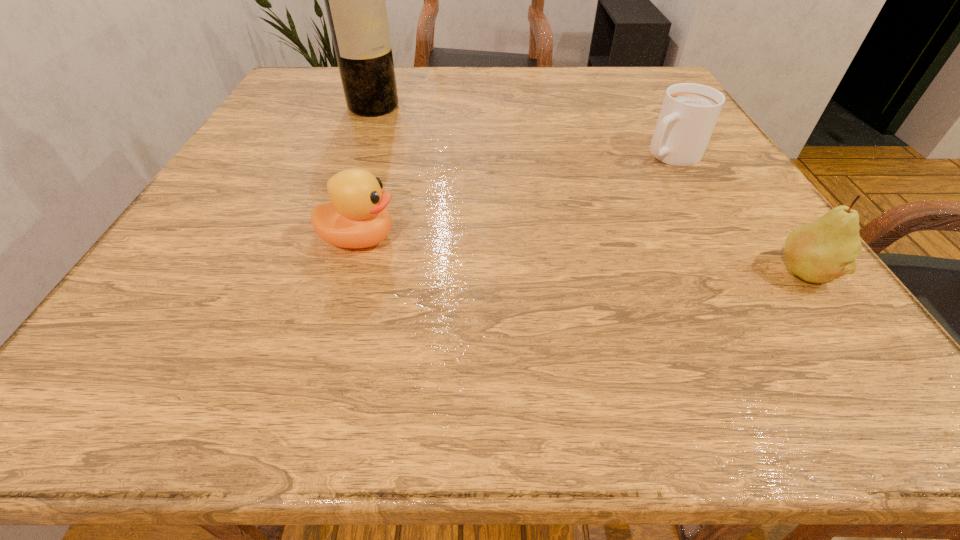
In the image, there is a desktop. Identify the location of vacant space at the left edge. (263, 259).

In the image, there is a desktop. Identify the location of vacant space at the right edge. (707, 242).

This screenshot has height=540, width=960. In order to click on vacant space at the far left corner in this screenshot , I will do `click(344, 97)`.

Locate an element on the screen. This screenshot has height=540, width=960. free space that is in between the cappuccino and the duckling is located at coordinates (515, 197).

The width and height of the screenshot is (960, 540). I want to click on unoccupied position between the duckling and the third nearest object, so click(x=515, y=197).

Identify the location of free space between the pear and the tallest object. (588, 190).

Where is `free spot between the third nearest object and the pear`? The width and height of the screenshot is (960, 540). free spot between the third nearest object and the pear is located at coordinates (737, 214).

The height and width of the screenshot is (540, 960). Identify the location of vacant space that is in between the third nearest object and the farthest object. (522, 131).

The width and height of the screenshot is (960, 540). I want to click on free space between the pear and the third nearest object, so click(737, 214).

You are a GUI agent. You are given a task and a screenshot of the screen. Output one action in this format:
    pyautogui.click(x=<x>, y=<y>)
    Task: Click on the vacant area between the pear and the cappuccino
    This screenshot has width=960, height=540.
    Given the screenshot: What is the action you would take?
    pyautogui.click(x=737, y=214)